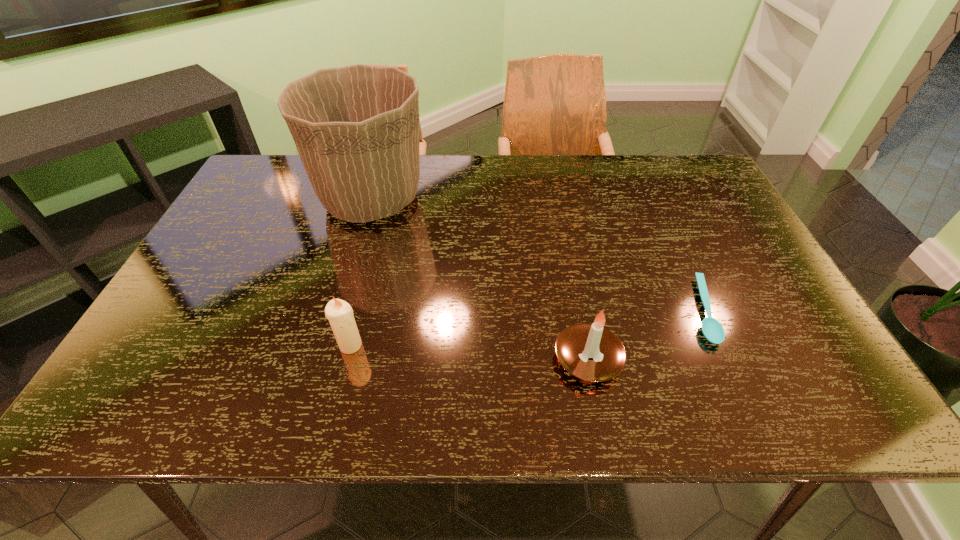
This screenshot has height=540, width=960. In order to click on blank region between the left candle and the right candle in this screenshot , I will do `click(469, 352)`.

Find the location of a particular element. The width and height of the screenshot is (960, 540). free space between the left candle and the third object from left to right is located at coordinates (469, 352).

Find the location of `free space that is in between the left candle and the shortest object`. free space that is in between the left candle and the shortest object is located at coordinates (527, 328).

Where is `unoccupied position between the left candle and the flowerpot`? Image resolution: width=960 pixels, height=540 pixels. unoccupied position between the left candle and the flowerpot is located at coordinates (361, 272).

This screenshot has height=540, width=960. In order to click on empty location between the flowerpot and the shortest object in this screenshot , I will do `click(537, 255)`.

What are the coordinates of `free space between the flowerpot and the rightmost object` in the screenshot? It's located at (537, 255).

Identify the location of unoccupied position between the tallest object and the right candle. The width and height of the screenshot is (960, 540). (480, 279).

The height and width of the screenshot is (540, 960). What are the coordinates of `object that is the third closest to the second object from right to left` in the screenshot? It's located at (357, 129).

Locate an element on the screen. the closest object to the spoon is located at coordinates (591, 352).

Where is `free space in the image that satisfies the following two spatial constraints: 1. on the front side of the farthest object; 2. on the right side of the rightmost object`? The height and width of the screenshot is (540, 960). free space in the image that satisfies the following two spatial constraints: 1. on the front side of the farthest object; 2. on the right side of the rightmost object is located at coordinates (339, 310).